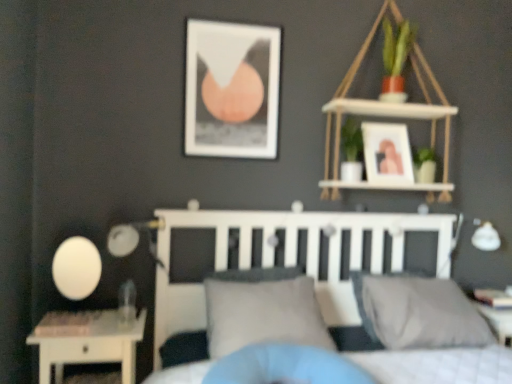
Identify the location of white glossy nightstand at lower left. (86, 342).

Locate an element on the screen. The image size is (512, 384). matte white picture frame at upper right, the second picture frame in the left-to-right sequence is located at coordinates (387, 153).

Which is correct: matte black picture frame at upper center, which is counted as the 1th picture frame, starting from the left, is inside white glossy nightstand at lower left, or outside of it?

matte black picture frame at upper center, which is counted as the 1th picture frame, starting from the left, is located beyond the bounds of white glossy nightstand at lower left.

Looking at this image, from a real-world perspective, is matte black picture frame at upper center, the second picture frame in the right-to-left sequence, located beneath white glossy nightstand at lower left?

Incorrect, from a real-world perspective, matte black picture frame at upper center, the second picture frame in the right-to-left sequence, is higher than white glossy nightstand at lower left.

How different are the orientations of matte black picture frame at upper center, the second picture frame in the right-to-left sequence, and white glossy nightstand at lower left in degrees?

0.944 degrees separate the facing orientations of matte black picture frame at upper center, the second picture frame in the right-to-left sequence, and white glossy nightstand at lower left.

Who is shorter, matte black picture frame at upper center, which is counted as the 1th picture frame, starting from the left, or white glossy nightstand at lower left?

white glossy nightstand at lower left is shorter.

Does point (433, 324) appear closer or farther from the camera than point (121, 232)?

Point (433, 324) is closer to the camera than point (121, 232).

There is a matte black table lamp at left. Where is `the 2nd pillow below it (from the image's perspective)`? the 2nd pillow below it (from the image's perspective) is located at coordinates (418, 312).

Based on their positions, is gray fabric pillow at center, the 2th pillow viewed from the left, located to the left or right of matte black table lamp at left?

gray fabric pillow at center, the 2th pillow viewed from the left, is to the right of matte black table lamp at left.

Is gray fabric pillow at center, which ranks as the 1th pillow in right-to-left order, looking in the opposite direction of matte black table lamp at left?

No, matte black table lamp at left is not at the back of gray fabric pillow at center, which ranks as the 1th pillow in right-to-left order.

Can you confirm if white wood shelf at upper right is taller than gray fabric pillow at center, which is the 2th pillow from right to left?

Correct, white wood shelf at upper right is much taller as gray fabric pillow at center, which is the 2th pillow from right to left.

Does white wood shelf at upper right touch gray fabric pillow at center, the first pillow positioned from the left?

white wood shelf at upper right is not next to gray fabric pillow at center, the first pillow positioned from the left, and they're not touching.

From a real-world perspective, which is physically above, white wood shelf at upper right or gray fabric pillow at center, which is the 2th pillow from right to left?

white wood shelf at upper right, from a real-world perspective.

Is point (356, 102) closer or farther from the camera than point (214, 315)?

Point (356, 102) is farther from the camera than point (214, 315).

Can you confirm if white glossy nightstand at lower left is positioned to the right of white wood shelf at upper right?

No.

Which of these two, white glossy nightstand at lower left or white wood shelf at upper right, is bigger?

white wood shelf at upper right is bigger.

Is white glossy nightstand at lower left turned away from white wood shelf at upper right?

No, white glossy nightstand at lower left's orientation is not away from white wood shelf at upper right.

Visually, is matte white picture frame at upper right, the second picture frame in the left-to-right sequence, positioned to the left or to the right of gray fabric pillow at center, the first pillow positioned from the left?

Clearly, matte white picture frame at upper right, the second picture frame in the left-to-right sequence, is on the right of gray fabric pillow at center, the first pillow positioned from the left, in the image.

Is matte white picture frame at upper right, the 1th picture frame in the right-to-left sequence, wider or thinner than gray fabric pillow at center, the first pillow positioned from the left?

In the image, matte white picture frame at upper right, the 1th picture frame in the right-to-left sequence, appears to be more narrow than gray fabric pillow at center, the first pillow positioned from the left.

In terms of size, does matte white picture frame at upper right, the second picture frame in the left-to-right sequence, appear bigger or smaller than gray fabric pillow at center, which is the 2th pillow from right to left?

Considering their sizes, matte white picture frame at upper right, the second picture frame in the left-to-right sequence, takes up less space than gray fabric pillow at center, which is the 2th pillow from right to left.

Is point (372, 162) closer or farther from the camera than point (287, 319)?

Point (372, 162) appears to be farther away from the viewer than point (287, 319).

Looking at this image, is matte black picture frame at upper center, which is counted as the 1th picture frame, starting from the left, located within white matte bed at center?

No.

Between white matte bed at center and matte black picture frame at upper center, which is counted as the 1th picture frame, starting from the left, which one has more height?

With more height is white matte bed at center.

Considering the points (192, 213) and (231, 124), which point is behind, point (192, 213) or point (231, 124)?

The point (231, 124) is farther.

Which object is wider, white matte bed at center or matte black picture frame at upper center, which is counted as the 1th picture frame, starting from the left?

white matte bed at center is wider.

From the image's perspective, is gray fabric pillow at center, the 2th pillow viewed from the left, above or below white wood shelf at upper right?

Based on their image positions, gray fabric pillow at center, the 2th pillow viewed from the left, is located beneath white wood shelf at upper right.

Which is farther, [413,317] or [418,108]?

The point [418,108] is behind.

Which of these two, gray fabric pillow at center, the 2th pillow viewed from the left, or white wood shelf at upper right, is smaller?

gray fabric pillow at center, the 2th pillow viewed from the left.

From the image's perspective, starting from the white glossy nightstand at lower left, which picture frame is the 2nd one above? Please provide its 2D coordinates.

[(232, 89)]

Which pillow is the 1st one when counting from the front of the matte black table lamp at left? Please provide its 2D coordinates.

[(418, 312)]

Based on their spatial positions, is matte black picture frame at upper center, which is counted as the 1th picture frame, starting from the left, or matte white picture frame at upper right, the second picture frame in the left-to-right sequence, further from gray fabric pillow at center, the first pillow positioned from the left?

matte white picture frame at upper right, the second picture frame in the left-to-right sequence, lies further to gray fabric pillow at center, the first pillow positioned from the left, than the other object.

Based on their spatial positions, is white matte bed at center or white wood shelf at upper right further from gray fabric pillow at center, the first pillow positioned from the left?

white wood shelf at upper right.

Considering their positions, is white matte bed at center positioned further to white wood shelf at upper right than matte black table lamp at left?

matte black table lamp at left is positioned further to the anchor white wood shelf at upper right.

Looking at the image, which one is located further to matte black table lamp at left, gray fabric pillow at center, the 2th pillow viewed from the left, or white glossy nightstand at lower left?

gray fabric pillow at center, the 2th pillow viewed from the left, is further to matte black table lamp at left.

Looking at the image, which one is located further to matte black picture frame at upper center, the second picture frame in the right-to-left sequence, matte white picture frame at upper right, the second picture frame in the left-to-right sequence, or matte black table lamp at left?

matte black table lamp at left is positioned further to the anchor matte black picture frame at upper center, the second picture frame in the right-to-left sequence.

Estimate the real-world distances between objects in this image. Which object is closer to white wood shelf at upper right, white matte bed at center or matte white picture frame at upper right, the second picture frame in the left-to-right sequence?

matte white picture frame at upper right, the second picture frame in the left-to-right sequence.

When comparing their distances from white wood shelf at upper right, does matte black picture frame at upper center, the second picture frame in the right-to-left sequence, or white matte bed at center seem closer?

white matte bed at center is positioned closer to the anchor white wood shelf at upper right.

When comparing their distances from white glossy nightstand at lower left, does matte white picture frame at upper right, the 1th picture frame in the right-to-left sequence, or matte black table lamp at left seem further?

The object further to white glossy nightstand at lower left is matte white picture frame at upper right, the 1th picture frame in the right-to-left sequence.

Where is `shelf that lies between matte black picture frame at upper center, which is counted as the 1th picture frame, starting from the left, and gray fabric pillow at center, the 2th pillow viewed from the left, from top to bottom`? The image size is (512, 384). shelf that lies between matte black picture frame at upper center, which is counted as the 1th picture frame, starting from the left, and gray fabric pillow at center, the 2th pillow viewed from the left, from top to bottom is located at coordinates (384, 116).

The image size is (512, 384). What are the coordinates of `nightstand between white matte bed at center and white wood shelf at upper right in the front-back direction` in the screenshot? It's located at (86, 342).

Locate an element on the screen. picture frame between white wood shelf at upper right and gray fabric pillow at center, the first pillow positioned from the left, from top to bottom is located at coordinates (387, 153).

Identify the location of shelf between matte black table lamp at left and gray fabric pillow at center, which ranks as the 1th pillow in right-to-left order, in the horizontal direction. (384, 116).